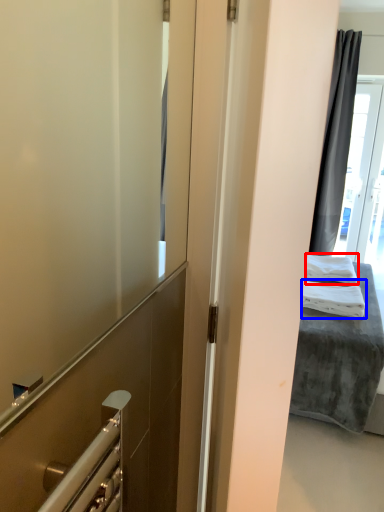
Question: Which object appears closest to the camera in this image, bath towel (highlighted by a red box) or bath towel (highlighted by a blue box)?

Choices:
 (A) bath towel
 (B) bath towel

Answer: (B)